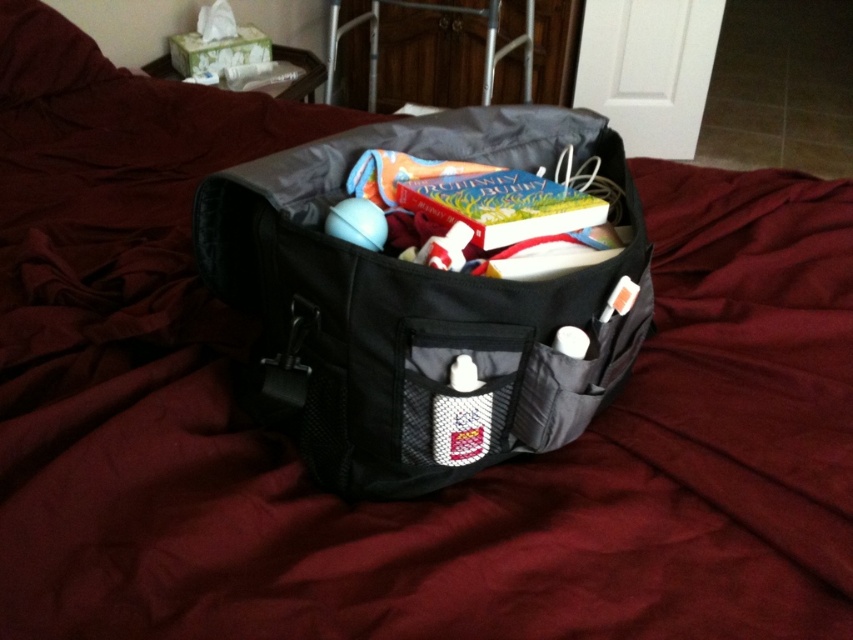
Question: Which of the following is the closest to the observer?

Choices:
 (A) black fabric bag at center
 (B) white mesh pocket at center

Answer: (A)

Question: Is black fabric bag at center below white mesh pocket at center?

Choices:
 (A) yes
 (B) no

Answer: (B)

Question: Which object is farther from the camera taking this photo?

Choices:
 (A) black fabric bag at center
 (B) white mesh pocket at center

Answer: (B)

Question: Does black fabric bag at center appear on the left side of white mesh pocket at center?

Choices:
 (A) no
 (B) yes

Answer: (A)

Question: Is black fabric bag at center thinner than white mesh pocket at center?

Choices:
 (A) yes
 (B) no

Answer: (B)

Question: Which point is closer to the camera taking this photo?

Choices:
 (A) (440, 460)
 (B) (431, 476)

Answer: (A)